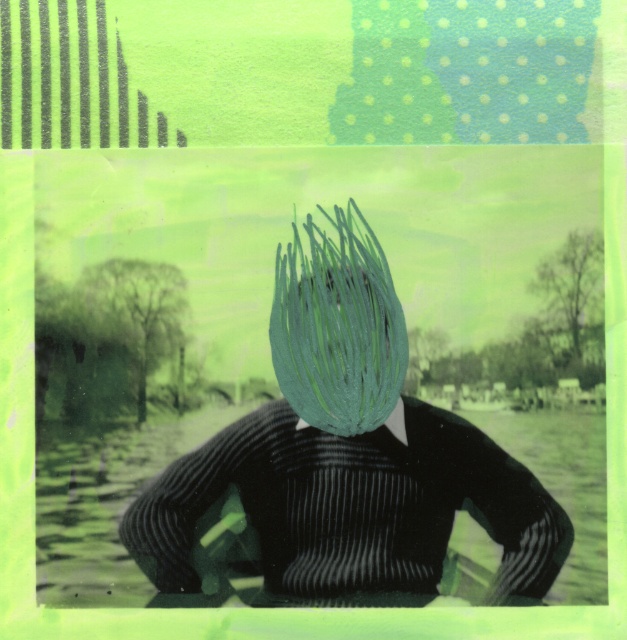
Does matte green hairbrush at center have a lesser width compared to green matte hair at center?

In fact, matte green hairbrush at center might be wider than green matte hair at center.

Image resolution: width=627 pixels, height=640 pixels. What do you see at coordinates (349, 452) in the screenshot?
I see `matte green hairbrush at center` at bounding box center [349, 452].

Who is more distant from viewer, (x=482, y=483) or (x=361, y=365)?

The point (x=361, y=365) is behind.

You are a GUI agent. You are given a task and a screenshot of the screen. Output one action in this format:
    pyautogui.click(x=<x>, y=<y>)
    Task: Click on the matte green hairbrush at center
    
    Given the screenshot: What is the action you would take?
    pyautogui.click(x=349, y=452)